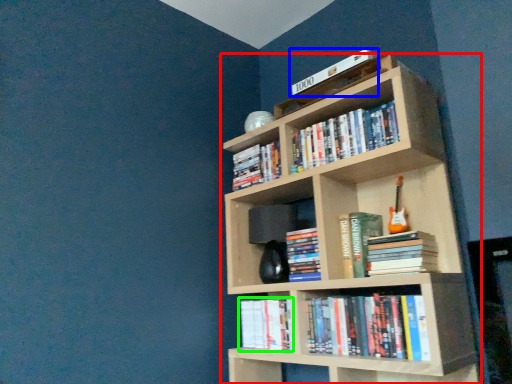
Question: Which is nearer to the bookcase (highlighted by a red box)? book (highlighted by a blue box) or book (highlighted by a green box).

Choices:
 (A) book
 (B) book

Answer: (B)